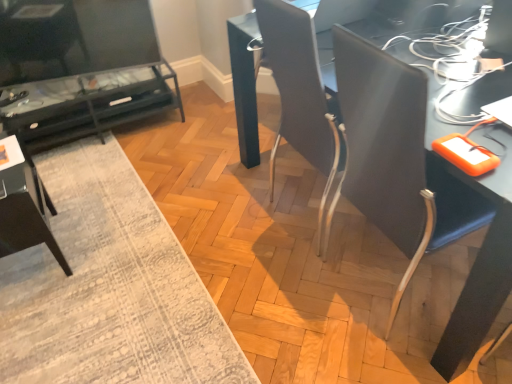
Where is `vacant area that lies between matte black table at center, the 1th table from the right, and textured gray rug at lower left`? The image size is (512, 384). vacant area that lies between matte black table at center, the 1th table from the right, and textured gray rug at lower left is located at coordinates (222, 212).